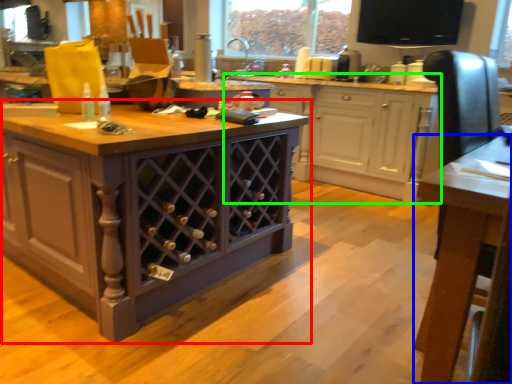
Question: Estimate the real-world distances between objects in this image. Which object is farther from cabinetry (highlighted by a red box), table (highlighted by a blue box) or cabinetry (highlighted by a green box)?

Choices:
 (A) table
 (B) cabinetry

Answer: (B)